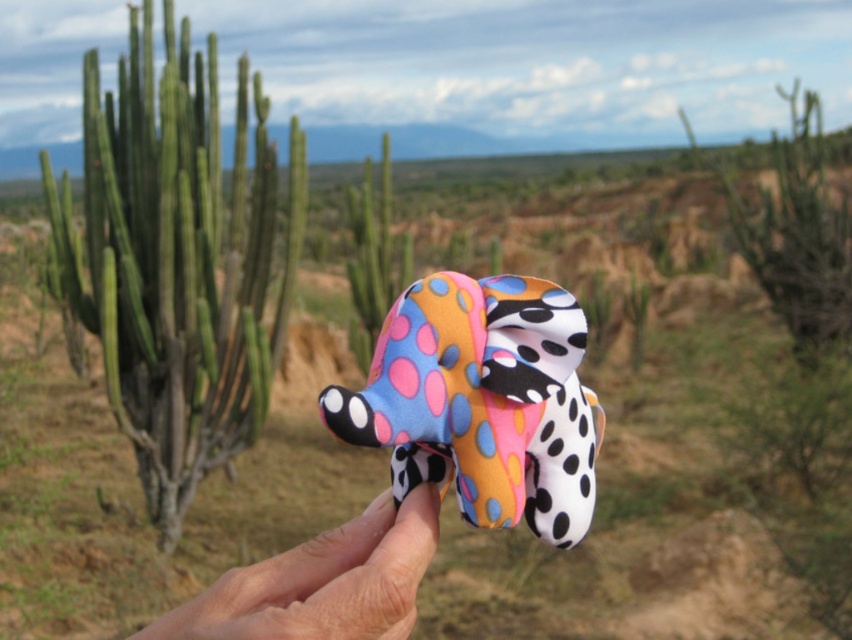
Question: Which object is the closest to the green matte cactus at left?

Choices:
 (A) smooth skin hand at center
 (B) polka dot fabric elephant at center

Answer: (B)

Question: Is polka dot fabric elephant at center behind smooth skin hand at center?

Choices:
 (A) no
 (B) yes

Answer: (B)

Question: Which of the following is the farthest from the observer?

Choices:
 (A) green matte cactus at left
 (B) smooth skin hand at center
 (C) polka dot fabric elephant at center

Answer: (A)

Question: Observing the image, what is the correct spatial positioning of polka dot fabric elephant at center in reference to smooth skin hand at center?

Choices:
 (A) left
 (B) right

Answer: (B)

Question: Is green matte cactus at left below polka dot fabric elephant at center?

Choices:
 (A) yes
 (B) no

Answer: (B)

Question: Which object is farther from the camera taking this photo?

Choices:
 (A) polka dot fabric elephant at center
 (B) smooth skin hand at center

Answer: (A)